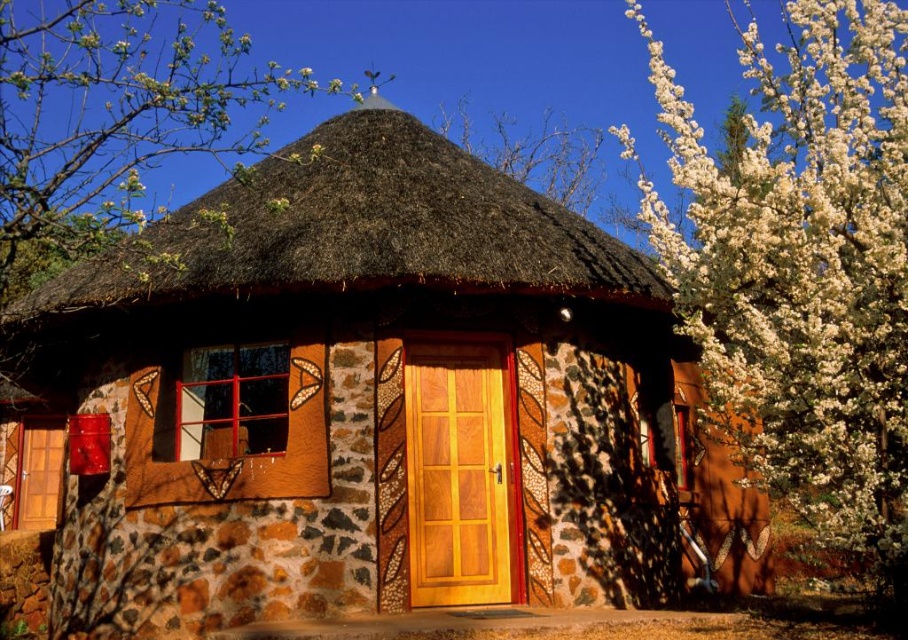
Question: Is white fluffy petals at upper right positioned at the back of brown thatch at center?

Choices:
 (A) no
 (B) yes

Answer: (A)

Question: Can you confirm if brown thatch at center is wider than green leafy tree at upper left?

Choices:
 (A) yes
 (B) no

Answer: (B)

Question: Which object appears farthest from the camera in this image?

Choices:
 (A) rustic stone cottage at center
 (B) green leafy tree at upper left
 (C) brown thatch at center
 (D) white fluffy petals at upper right

Answer: (C)

Question: Among these objects, which one is farthest from the camera?

Choices:
 (A) brown thatch at center
 (B) rustic stone cottage at center
 (C) green leafy tree at upper left
 (D) white fluffy petals at upper right

Answer: (A)

Question: Is white fluffy petals at upper right bigger than green leafy tree at upper left?

Choices:
 (A) no
 (B) yes

Answer: (A)

Question: Which object is farther from the camera taking this photo?

Choices:
 (A) brown thatch at center
 (B) white fluffy petals at upper right
 (C) rustic stone cottage at center

Answer: (A)